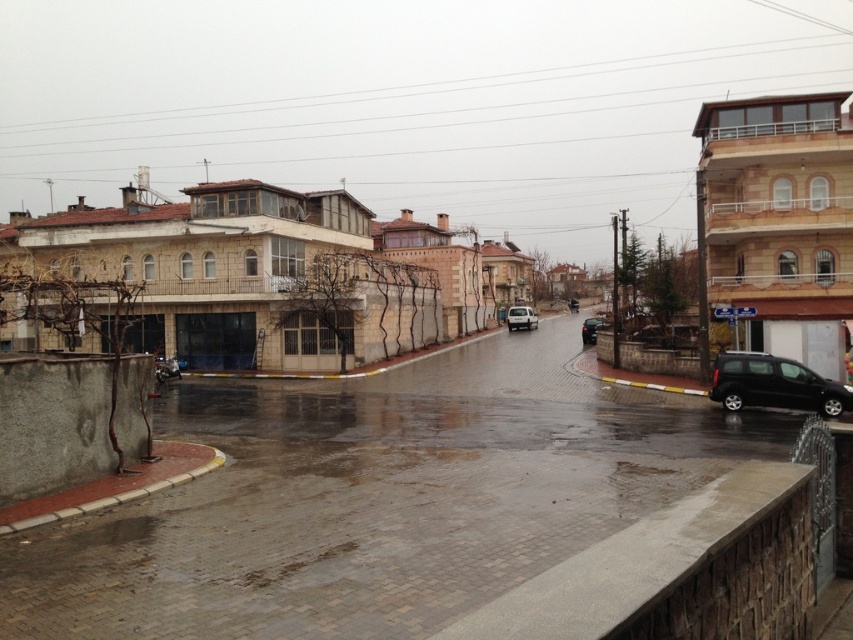
Question: Which point appears farthest from the camera in this image?

Choices:
 (A) (582, 332)
 (B) (171, 362)
 (C) (572, 305)

Answer: (C)

Question: Can you confirm if wet concrete pavement at lower center is positioned to the left of black matte van at lower right?

Choices:
 (A) no
 (B) yes

Answer: (B)

Question: Which point is farther to the camera?

Choices:
 (A) white matte van at center
 (B) black matte van at lower right
 (C) matte black car at center
 (D) wet concrete pavement at lower center

Answer: (C)

Question: Is wet concrete pavement at lower center closer to camera compared to white matte van at center?

Choices:
 (A) no
 (B) yes

Answer: (B)

Question: Which point is farther to the camera?

Choices:
 (A) matte black car at center
 (B) metallic silver scooter at lower left
 (C) shiny black car at right

Answer: (A)

Question: Does black matte van at lower right appear under matte black car at center?

Choices:
 (A) yes
 (B) no

Answer: (A)